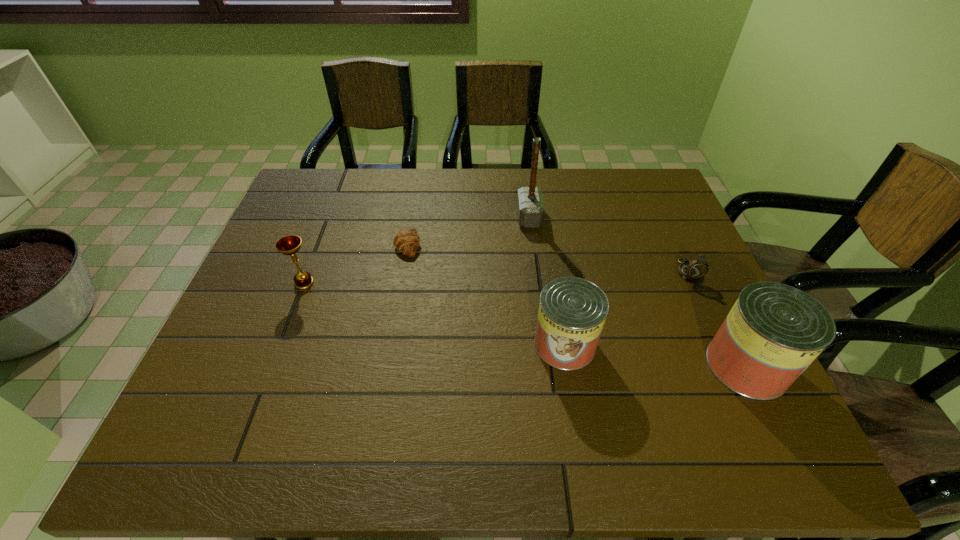
Where is `the left can`? This screenshot has width=960, height=540. the left can is located at coordinates (572, 312).

The height and width of the screenshot is (540, 960). Identify the location of the taller can. (774, 331).

Locate an element on the screen. the second tallest object is located at coordinates (774, 331).

I want to click on the tallest object, so click(x=530, y=204).

The image size is (960, 540). What are the coordinates of `the farthest object` in the screenshot? It's located at (530, 204).

This screenshot has height=540, width=960. What are the coordinates of `chalice` in the screenshot? It's located at (288, 245).

Find the location of `crescent roll`. crescent roll is located at coordinates (406, 241).

At what (x,y) coordinates should I click in order to perform the action: click on the shortest object. Please return your answer as a coordinate pair (x, y). Looking at the image, I should click on (406, 241).

Where is `the second shortest object`? the second shortest object is located at coordinates (697, 268).

Find the location of a particular element. vacant space located on the left of the shorter can is located at coordinates (455, 345).